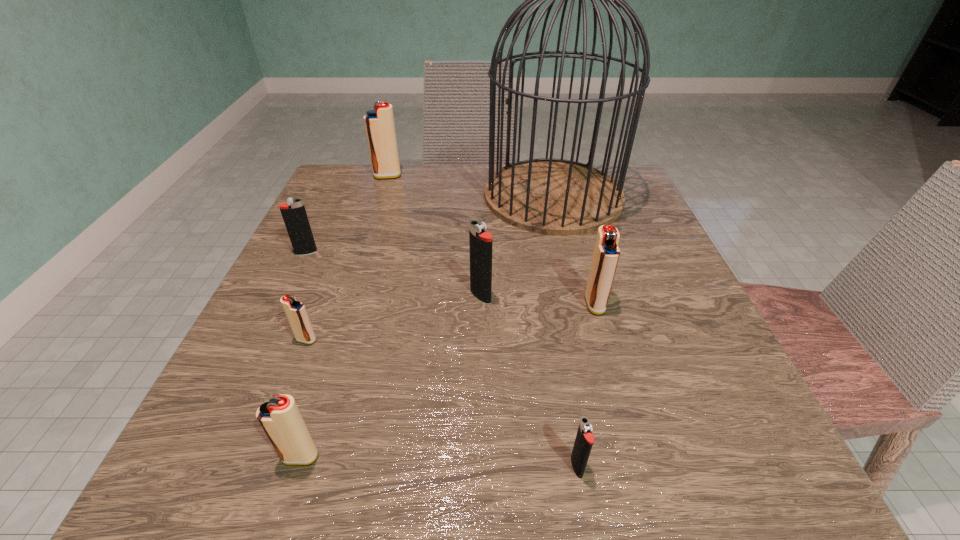
Select which red igniter appears as the second closest to the leftmost igniter. Please provide its 2D coordinates. Your answer should be formatted as a tuple, i.e. [(x, y)], where the tuple contains the x and y coordinates of a point satisfying the conditions above.

[(379, 123)]

Find the location of a particular element. red igniter that can be found as the third closest to the sixth igniter from left to right is located at coordinates (295, 311).

Locate an element on the screen. This screenshot has height=540, width=960. black igniter that can be found as the second closest to the smallest red igniter is located at coordinates (480, 241).

Locate which black igniter ranks second in proximity to the rightmost igniter. Please provide its 2D coordinates. Your answer should be formatted as a tuple, i.e. [(x, y)], where the tuple contains the x and y coordinates of a point satisfying the conditions above.

[(584, 440)]

The height and width of the screenshot is (540, 960). What are the coordinates of `free region that satisfies the following two spatial constraints: 1. on the back side of the rightmost red igniter; 2. at the door of the birdcage` in the screenshot? It's located at (564, 196).

At what (x,y) coordinates should I click in order to perform the action: click on vacant space that satisfies the following two spatial constraints: 1. on the front side of the rightmost igniter; 2. on the left side of the second nearest black igniter. Please return your answer as a coordinate pair (x, y). This screenshot has width=960, height=540. Looking at the image, I should click on (481, 304).

This screenshot has width=960, height=540. In order to click on free location that satisfies the following two spatial constraints: 1. at the door of the gray birdcage; 2. on the front side of the nearest black igniter in this screenshot , I will do `click(617, 467)`.

This screenshot has width=960, height=540. I want to click on vacant space that satisfies the following two spatial constraints: 1. at the door of the gray birdcage; 2. on the front side of the leftmost object, so click(x=566, y=253).

The width and height of the screenshot is (960, 540). In order to click on blank space that satisfies the following two spatial constraints: 1. at the door of the third nearest red igniter; 2. on the right side of the tallest object in this screenshot , I will do `click(579, 304)`.